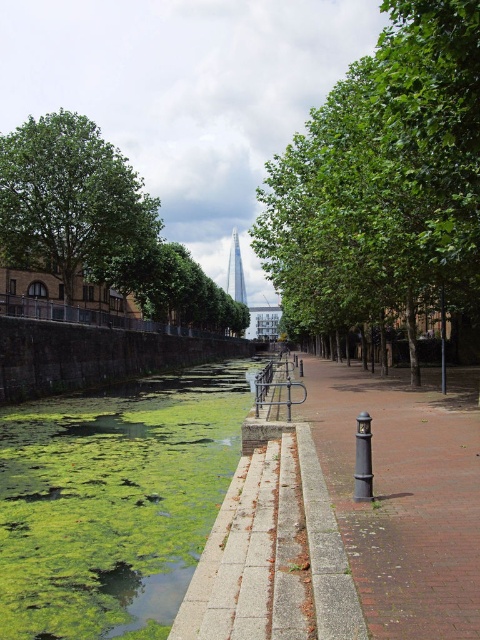
You are a gardener planning to plant a new shrub between the brick pavement at center and the green leafy tree at left. Based on their sizes, which object should you place the shrub closer to?

The brick pavement at center is smaller than the green leafy tree at left, so you should place the shrub closer to the brick pavement at center to maintain proper spacing.

You are a landscape architect planning to install a new bench along the riverside pathway. The bench requires a space wider than the brick pavement at center. Can the green leafy tree at center provide enough space for this bench?

The green leafy tree at center might be wider than brick pavement at center, so it could potentially provide enough space for the bench if its width meets or exceeds the required width for the bench.

You are a maintenance worker tasked with cleaning the green algae at center and the brick pavement at center. Based on the scene, which object is closer to the left side of the pathway?

The green algae at center is closer to the left side of the pathway since it is positioned to the left of the brick pavement at center.